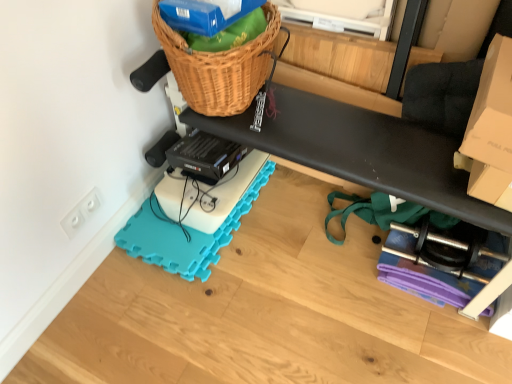
Locate an element on the screen. This screenshot has height=384, width=512. free space in front of teal foam yoga mat at lower left is located at coordinates (208, 315).